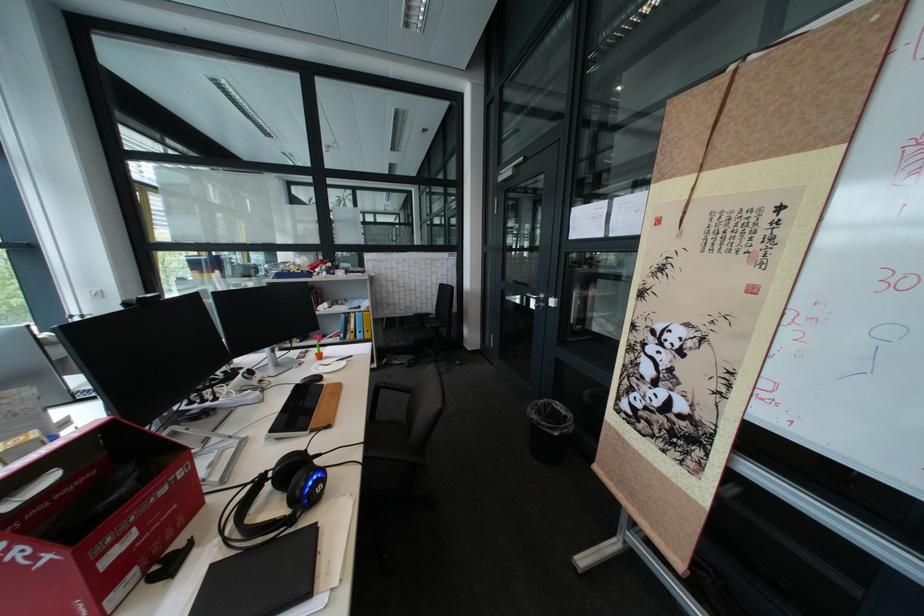
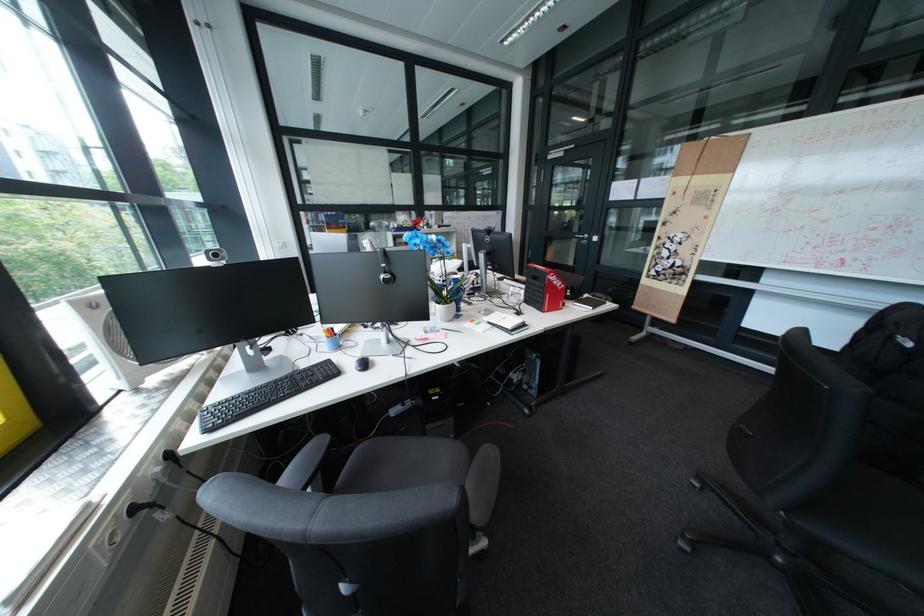
The images are taken continuously from a first-person perspective. In which direction are you moving?

The movement direction of the cameraman is left, backward.